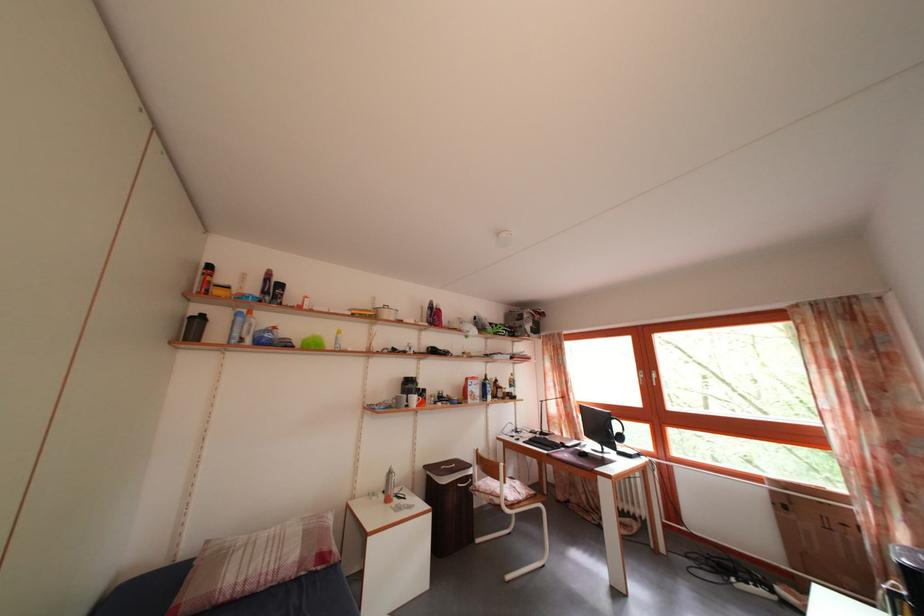
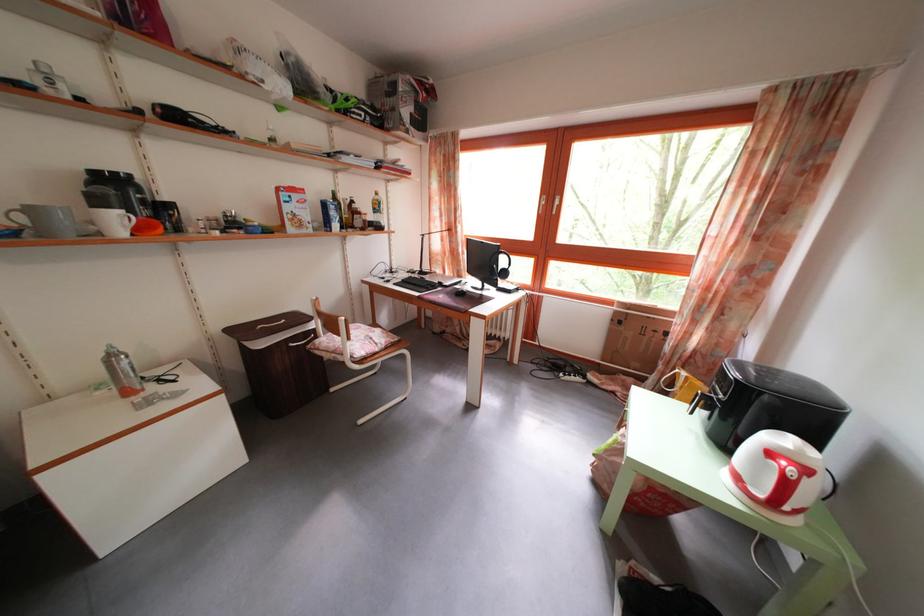
Locate, in the second image, the point that corresponds to pixel 576 455 in the first image.

(454, 294)